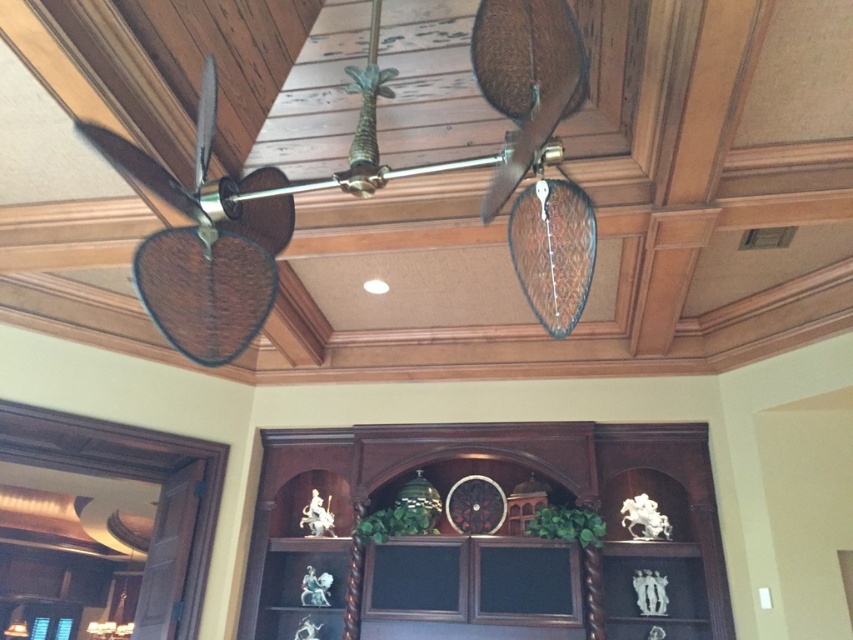
Is brown woven fan at left further to camera compared to rattan/wooden ceiling fan at upper center?

Yes, brown woven fan at left is behind rattan/wooden ceiling fan at upper center.

Can you confirm if brown woven fan at left is smaller than rattan/wooden ceiling fan at upper center?

Yes, brown woven fan at left is smaller than rattan/wooden ceiling fan at upper center.

Is point (247, 305) positioned before point (344, 173)?

No, (247, 305) is further to viewer.

The height and width of the screenshot is (640, 853). Identify the location of brown woven fan at left. point(206,243).